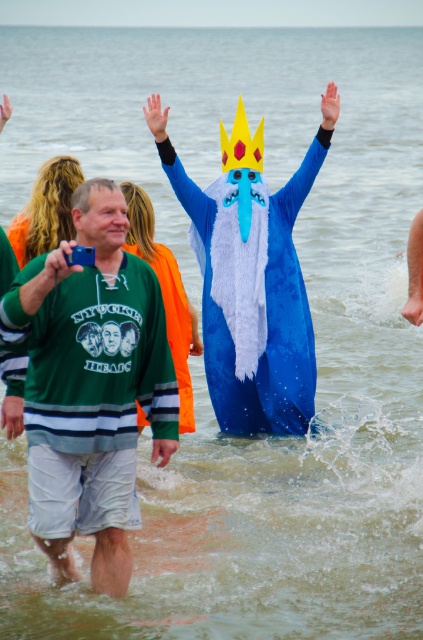
You are a photographer at the beach event. You see the green jersey at center and the yellow paper crown at center. Which object is higher up in the image?

The yellow paper crown at center is higher up because the green jersey at center is located below it.

You are organizing a photo shoot at the beach event. You need to position the green jersey at center and the blue plush costume at center so that both are visible in the frame. Which object should you place closer to the camera to ensure it takes up more space in the photo?

The blue plush costume at center should be placed closer to the camera because it occupies more space than the green jersey at center, so positioning it closer will ensure it appears larger in the photo while still allowing both to be visible.